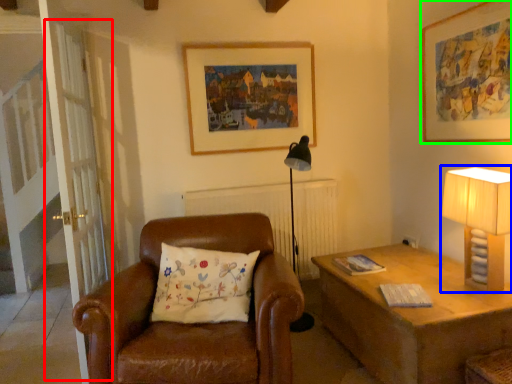
Question: Which object is the closest to the screen door (highlighted by a red box)? Choose among these: table lamp (highlighted by a blue box) or picture frame (highlighted by a green box).

Choices:
 (A) table lamp
 (B) picture frame

Answer: (A)